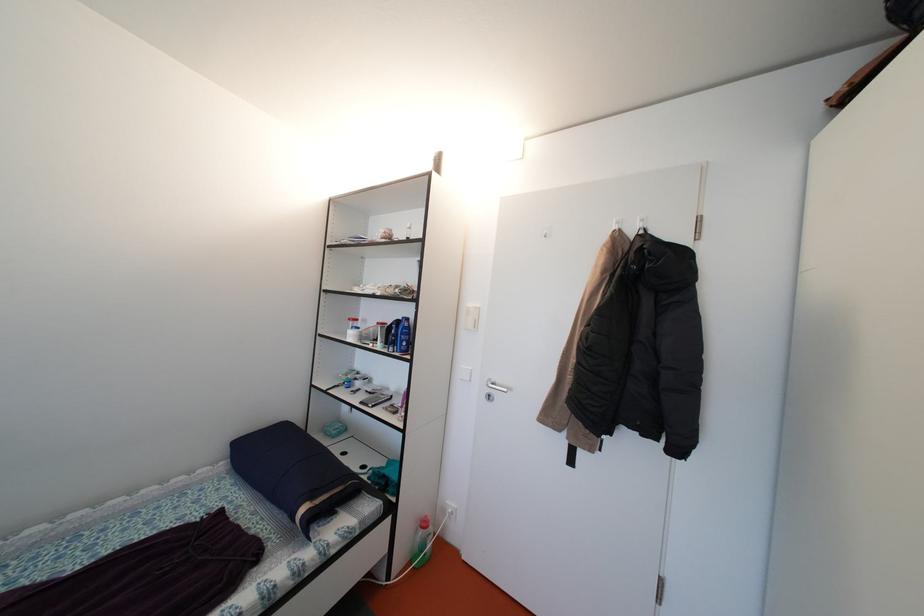
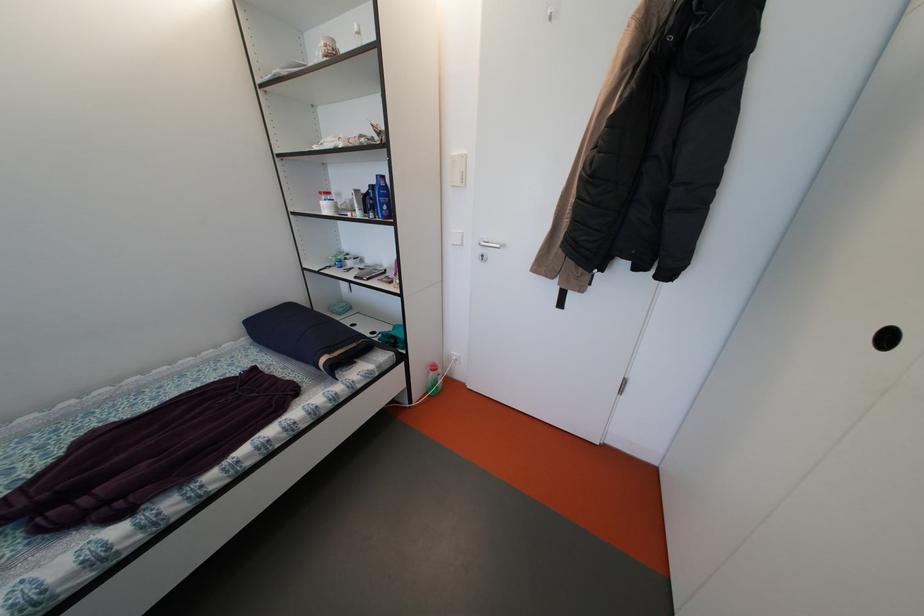
Find the pixel in the second image that matches (x=408, y=350) in the first image.

(390, 215)